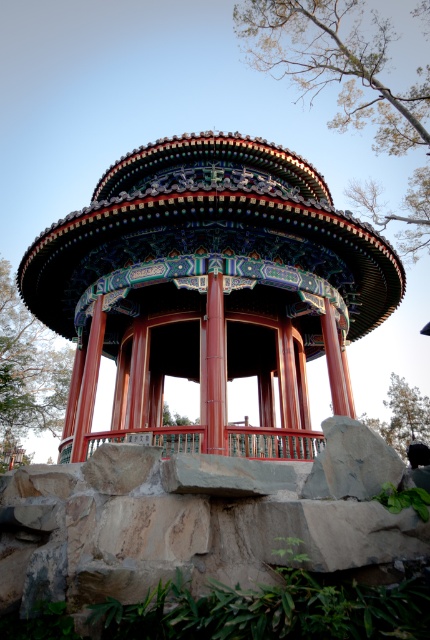
You are a visitor standing in the middle of the traditional Chinese pavilion. You notice two green leafy trees in the scene. Which tree, the green leafy tree at upper center or the green leafy tree at lower right, appears bigger in size?

The green leafy tree at upper center has a larger size compared to the green leafy tree at lower right, so the green leafy tree at upper center appears bigger in size.

You are standing at the center of the traditional Chinese pavilion. Looking out, you notice a point marked at coordinates (x=337, y=64). What object is located at that point?

The point at coordinates (x=337, y=64) corresponds to a green leafy tree at upper center.